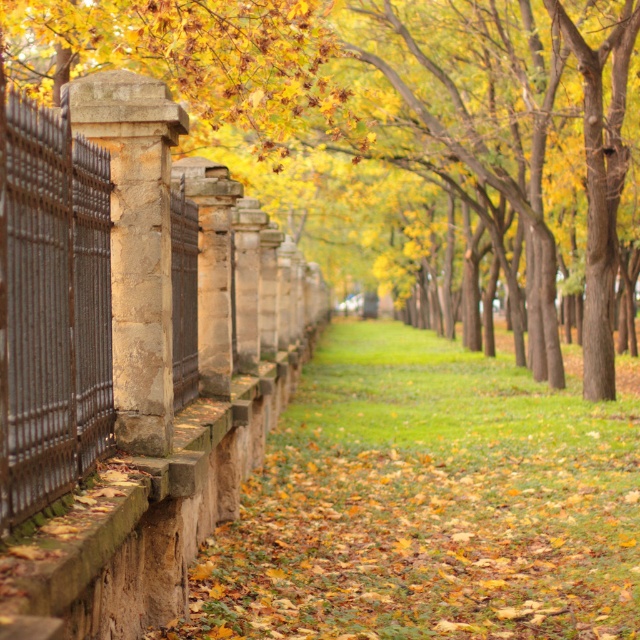
Does point (328, 488) come in front of point (157, 333)?

No, it is not.

Which of these two, yellow-green grass at center or stone column at left, stands taller?

Standing taller between the two is stone column at left.

Which is behind, point (525, 493) or point (120, 208)?

The point (525, 493) is behind.

I want to click on yellow-green grass at center, so click(x=428, y=504).

Between point (593, 204) and point (100, 92), which one is positioned in front?

Point (100, 92)

Does point (349, 168) come farther from viewer compared to point (160, 145)?

Yes, it is.

This screenshot has height=640, width=640. Identify the location of smooth stone pillar at left. (403, 132).

Who is shorter, smooth stone pillar at left or yellow-green grass at center?

Standing shorter between the two is yellow-green grass at center.

Does smooth stone pillar at left have a smaller size compared to yellow-green grass at center?

No.

Which is behind, point (292, 76) or point (461, 611)?

Positioned behind is point (292, 76).

This screenshot has height=640, width=640. I want to click on smooth stone pillar at left, so click(x=403, y=132).